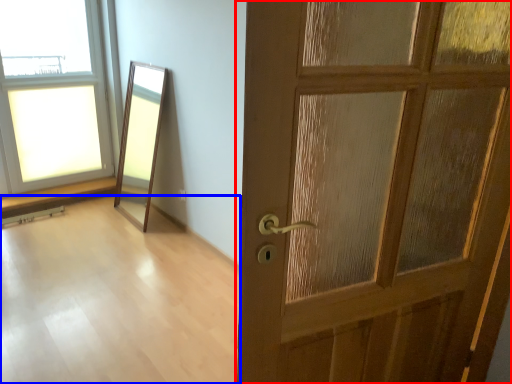
Question: Which of the following is the closest to the observer, door (highlighted by a red box) or corridor (highlighted by a blue box)?

Choices:
 (A) door
 (B) corridor

Answer: (A)